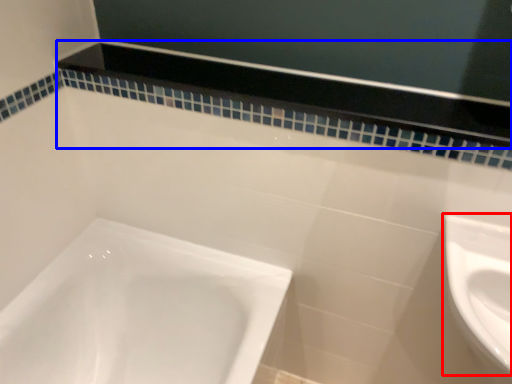
Question: Among these objects, which one is farthest to the camera, sink (highlighted by a red box) or balustrade (highlighted by a blue box)?

Choices:
 (A) sink
 (B) balustrade

Answer: (B)